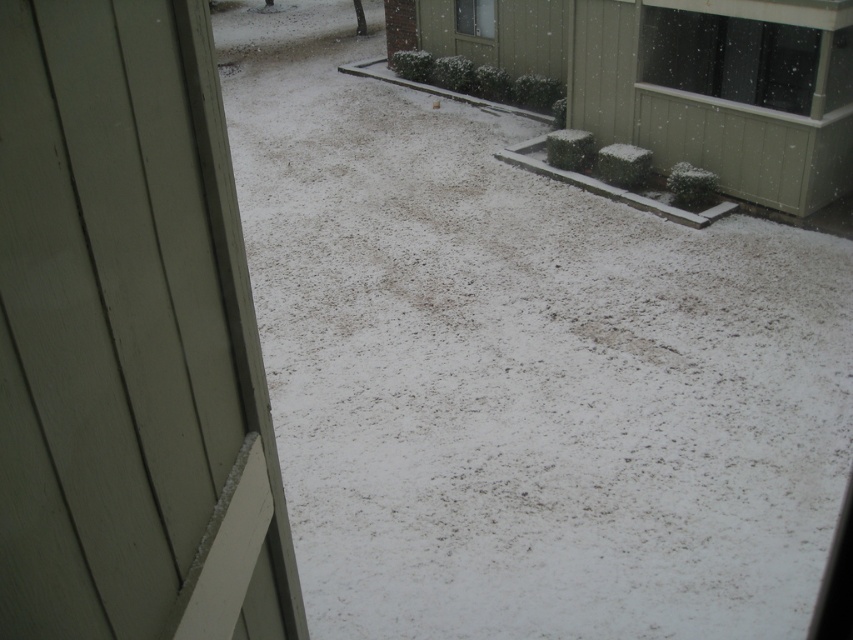
Question: Which is farther from the matte green screen door at left?

Choices:
 (A) transparent glass window at upper right
 (B) clear glass window at upper center

Answer: (B)

Question: Does matte green screen door at left have a lesser width compared to clear glass window at upper center?

Choices:
 (A) yes
 (B) no

Answer: (A)

Question: Does transparent glass window at upper right appear on the right side of clear glass window at upper center?

Choices:
 (A) no
 (B) yes

Answer: (B)

Question: Considering the relative positions of transparent glass window at upper right and clear glass window at upper center in the image provided, where is transparent glass window at upper right located with respect to clear glass window at upper center?

Choices:
 (A) right
 (B) left

Answer: (A)

Question: Which point is farther from the camera taking this photo?

Choices:
 (A) (16, 337)
 (B) (811, 40)
 (C) (465, 32)

Answer: (C)

Question: Based on their relative distances, which object is farther from the clear glass window at upper center?

Choices:
 (A) matte green screen door at left
 (B) transparent glass window at upper right

Answer: (A)